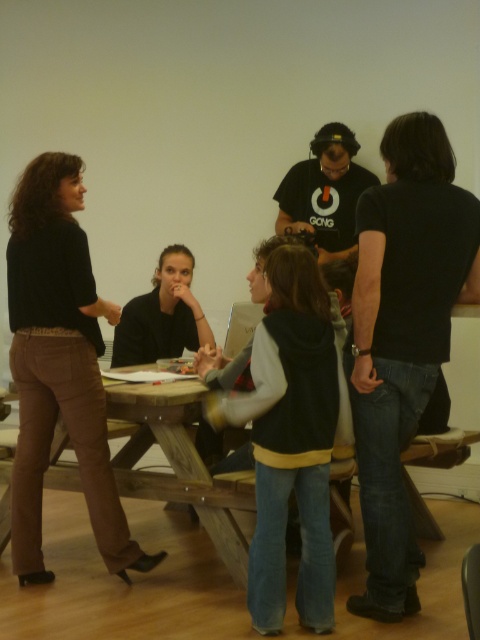
Which is in front, point (348, 428) or point (145, 424)?

Point (348, 428) is in front.

Does denim jacket at center lie behind wooden picnic table at center?

No, it is in front of wooden picnic table at center.

At what (x,y) coordinates should I click in order to perform the action: click on denim jacket at center. Please return your answer as a coordinate pair (x, y). Image resolution: width=480 pixels, height=640 pixels. Looking at the image, I should click on (289, 438).

The height and width of the screenshot is (640, 480). What do you see at coordinates (178, 465) in the screenshot? I see `wooden picnic table at center` at bounding box center [178, 465].

Does wooden picnic table at center have a lesser width compared to black matte shirt at center?

No.

Is point (133, 468) farther from camera compared to point (147, 294)?

That is False.

In order to click on wooden picnic table at center in this screenshot , I will do `click(178, 465)`.

Is brown cotton pants at left to the right of denim jacket at center from the viewer's perspective?

In fact, brown cotton pants at left is to the left of denim jacket at center.

Based on the photo, is brown cotton pants at left bigger than denim jacket at center?

Yes, brown cotton pants at left is bigger than denim jacket at center.

Locate an element on the screen. This screenshot has height=640, width=480. brown cotton pants at left is located at coordinates (59, 364).